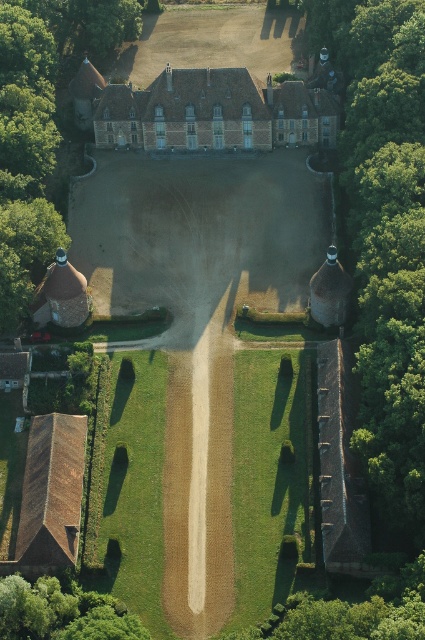
Question: Does green leafy tree at upper left have a smaller size compared to green leafy tree at lower left?

Choices:
 (A) no
 (B) yes

Answer: (A)

Question: Where is brown brick mansion at center located in relation to green leafy tree at lower left in the image?

Choices:
 (A) above
 (B) below

Answer: (A)

Question: Is brown brick mansion at center above green leafy tree at lower left?

Choices:
 (A) yes
 (B) no

Answer: (A)

Question: Which of the following is the farthest from the observer?

Choices:
 (A) green leafy tree at upper left
 (B) brown brick mansion at center
 (C) green leafy tree at lower left

Answer: (B)

Question: Among these objects, which one is farthest from the camera?

Choices:
 (A) brown brick mansion at center
 (B) green leafy tree at lower left
 (C) green leafy tree at upper left

Answer: (A)

Question: Which object is the closest to the green leafy tree at upper left?

Choices:
 (A) green leafy tree at lower left
 (B) brown brick mansion at center

Answer: (B)